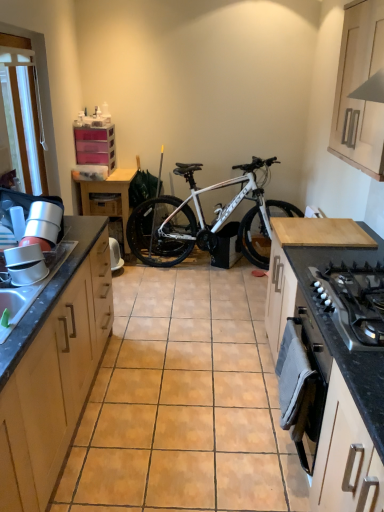
In order to face white matte bicycle at center, should I rotate leftwards or rightwards?

Rotate your view right by about 3.542°.

Measure the distance between point (99, 211) and camera.

Point (99, 211) and camera are 4.19 meters apart from each other.

You are a GUI agent. You are given a task and a screenshot of the screen. Output one action in this format:
    pyautogui.click(x=<x>, y=<y>)
    Task: Click on the wooden table at left
    The width and height of the screenshot is (384, 512).
    Given the screenshot: What is the action you would take?
    pyautogui.click(x=108, y=192)

Locate an element on the screen. This screenshot has width=384, height=512. white plastic screen door at upper left is located at coordinates (23, 112).

What is the approximate width of black granite countertop at lower right?

The width of black granite countertop at lower right is 20.69 inches.

This screenshot has height=512, width=384. I want to click on black granite countertop at lower right, so click(331, 355).

What is the approximate height of transparent plastic drawers at upper left, the 4th cabinetry viewed from the front?

transparent plastic drawers at upper left, the 4th cabinetry viewed from the front, is 45.49 centimeters in height.

Where is `white matte bicycle at center`? The height and width of the screenshot is (512, 384). white matte bicycle at center is located at coordinates (202, 219).

Can you confirm if wooden drawer at center is wider than white matte bicycle at center?

Yes.

Does wooden drawer at center have a larger size compared to white matte bicycle at center?

No.

Identify the location of bicycle located in front of the wooden drawer at center. (202, 219).

Is wooden drawer at center not within white matte bicycle at center?

Yes, wooden drawer at center is located beyond the bounds of white matte bicycle at center.

Which object is positioned more to the left, wooden drawer at center or transparent plastic drawers at upper left, the first cabinetry positioned from the left?

transparent plastic drawers at upper left, the first cabinetry positioned from the left.

Are wooden drawer at center and transparent plastic drawers at upper left, which is the 4th cabinetry in right-to-left order, beside each other?

They are not placed beside each other.

The height and width of the screenshot is (512, 384). I want to click on cabinetry on the left of wooden drawer at center, so click(95, 146).

Is wooden drawer at center wider than transparent plastic drawers at upper left, the 4th cabinetry viewed from the front?

Correct, the width of wooden drawer at center exceeds that of transparent plastic drawers at upper left, the 4th cabinetry viewed from the front.

From the image's perspective, between white matte cabinet at upper right, the second cabinetry from the back, and white glossy cabinet at lower right, which appears as the second cabinetry when viewed from the right, who is located below?

white glossy cabinet at lower right, which appears as the second cabinetry when viewed from the right, is shown below in the image.

Does white matte cabinet at upper right, the 1th cabinetry when ordered from right to left, have a greater height compared to white glossy cabinet at lower right, which appears as the second cabinetry when viewed from the right?

No, white matte cabinet at upper right, the 1th cabinetry when ordered from right to left, is not taller than white glossy cabinet at lower right, which appears as the second cabinetry when viewed from the right.

What's the angular difference between white matte cabinet at upper right, the second cabinetry from the back, and white glossy cabinet at lower right, which is counted as the 4th cabinetry, starting from the back,'s facing directions?

The angle between the facing direction of white matte cabinet at upper right, the second cabinetry from the back, and the facing direction of white glossy cabinet at lower right, which is counted as the 4th cabinetry, starting from the back, is 1.15 degrees.

Can you confirm if white matte cabinet at upper right, the 1th cabinetry when ordered from right to left, is taller than silver metallic gas stove at lower right?

Yes.

From the image's perspective, would you say white matte cabinet at upper right, marked as the fourth cabinetry in a left-to-right arrangement, is shown under silver metallic gas stove at lower right?

Actually, white matte cabinet at upper right, marked as the fourth cabinetry in a left-to-right arrangement, appears above silver metallic gas stove at lower right in the image.

Is point (359, 125) behind point (342, 287)?

Yes.

In the image, is white plastic screen door at upper left on the left side or the right side of wooden drawer at center?

white plastic screen door at upper left is positioned on wooden drawer at center's left side.

Looking at this image, does white plastic screen door at upper left have a lesser width compared to wooden drawer at center?

Yes.

Which is nearer, [5,68] or [116,208]?

Point [5,68] appears to be closer to the viewer than point [116,208].

Could you measure the distance between white glossy cabinet at lower right, which appears as the second cabinetry when viewed from the right, and white matte bicycle at center?

white glossy cabinet at lower right, which appears as the second cabinetry when viewed from the right, is 2.92 meters from white matte bicycle at center.

Which of these two, white glossy cabinet at lower right, which is counted as the 4th cabinetry, starting from the back, or white matte bicycle at center, is bigger?

white matte bicycle at center is bigger.

Would you say white matte bicycle at center is part of white glossy cabinet at lower right, which appears as the second cabinetry when viewed from the right,'s contents?

Actually, white matte bicycle at center is outside white glossy cabinet at lower right, which appears as the second cabinetry when viewed from the right.

Between point (336, 495) and point (154, 218), which one is positioned in front?

The point (336, 495) is closer to the camera.

From the image's perspective, which one is positioned higher, white glossy cabinet at lower right, which is the 3th cabinetry from left to right, or white plastic screen door at upper left?

white plastic screen door at upper left is shown above in the image.

Considering the relative sizes of white glossy cabinet at lower right, which is the 1th cabinetry in front-to-back order, and white plastic screen door at upper left in the image provided, is white glossy cabinet at lower right, which is the 1th cabinetry in front-to-back order, bigger than white plastic screen door at upper left?

Yes.

Is white glossy cabinet at lower right, which is counted as the 4th cabinetry, starting from the back, not near white plastic screen door at upper left?

Yes, white glossy cabinet at lower right, which is counted as the 4th cabinetry, starting from the back, and white plastic screen door at upper left are located far from each other.

Would you say white glossy cabinet at lower right, which is the 3th cabinetry from left to right, is outside white plastic screen door at upper left?

That's correct, white glossy cabinet at lower right, which is the 3th cabinetry from left to right, is outside of white plastic screen door at upper left.

The image size is (384, 512). I want to click on drawer above the white matte bicycle at center (from the image's perspective), so click(x=105, y=204).

The width and height of the screenshot is (384, 512). What are the coordinates of `drawer located behind the transparent plastic drawers at upper left, the 4th cabinetry viewed from the front` in the screenshot? It's located at pyautogui.click(x=105, y=204).

Estimate the real-world distances between objects in this image. Which object is closer to wooden drawer at center, white matte bicycle at center or transparent plastic drawers at upper left, which is the 4th cabinetry in right-to-left order?

transparent plastic drawers at upper left, which is the 4th cabinetry in right-to-left order.

Based on the photo, from the image, which object appears to be farther from white matte bicycle at center, wooden drawer at center or silver metallic gas stove at lower right?

Among the two, silver metallic gas stove at lower right is located further to white matte bicycle at center.

When comparing their distances from transparent plastic drawers at upper left, the 4th cabinetry viewed from the front, does white glossy sink at left or white glossy cabinet at lower right, which is counted as the 4th cabinetry, starting from the back, seem closer?

white glossy sink at left.

Considering their positions, is white glossy cabinet at lower right, which is counted as the 4th cabinetry, starting from the back, positioned closer to black granite countertop at lower right than white matte cabinet at upper right, the second cabinetry from the back?

The object closer to black granite countertop at lower right is white glossy cabinet at lower right, which is counted as the 4th cabinetry, starting from the back.

Which object lies nearer to the anchor point white matte cabinet at upper right, the 1th cabinetry when ordered from right to left, white matte bicycle at center or white plastic screen door at upper left?

Among the two, white plastic screen door at upper left is located nearer to white matte cabinet at upper right, the 1th cabinetry when ordered from right to left.

When comparing their distances from black granite countertop at lower right, does white glossy sink at left or white glossy cabinet at lower right, which is the 3th cabinetry from left to right, seem further?

white glossy sink at left is further to black granite countertop at lower right.

From the picture: Looking at the image, which one is located further to wooden cabinet at left, placed as the third cabinetry when sorted from back to front, white glossy sink at left or white matte cabinet at upper right, the 1th cabinetry when ordered from right to left?

Among the two, white matte cabinet at upper right, the 1th cabinetry when ordered from right to left, is located further to wooden cabinet at left, placed as the third cabinetry when sorted from back to front.

Considering their positions, is white glossy cabinet at lower right, which is the 1th cabinetry in front-to-back order, positioned further to black granite countertop at lower right than white glossy sink at left?

white glossy sink at left lies further to black granite countertop at lower right than the other object.

Identify the location of screen door between black granite countertop at lower right and white matte bicycle at center from front to back. The height and width of the screenshot is (512, 384). (23, 112).

Find the location of a particular element. The width and height of the screenshot is (384, 512). table located between white plastic screen door at upper left and white matte bicycle at center in the depth direction is located at coordinates (108, 192).

Where is `sink between white glossy cabinet at lower right, which is the 3th cabinetry from left to right, and wooden drawer at center, along the z-axis`? The height and width of the screenshot is (512, 384). sink between white glossy cabinet at lower right, which is the 3th cabinetry from left to right, and wooden drawer at center, along the z-axis is located at coordinates (30, 289).

Locate an element on the screen. The height and width of the screenshot is (512, 384). screen door between white glossy cabinet at lower right, which is the 3th cabinetry from left to right, and transparent plastic drawers at upper left, the first cabinetry viewed from the back, along the z-axis is located at coordinates (23, 112).